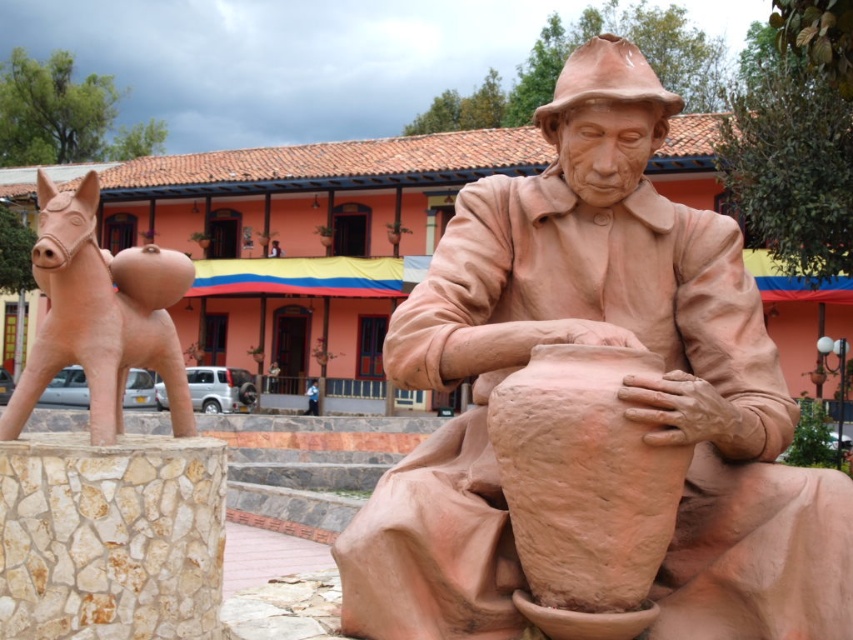
Which of these two, matte clay potter at center or matte clay horse at left, stands shorter?

With less height is matte clay potter at center.

Does matte clay potter at center appear over matte clay horse at left?

No, matte clay potter at center is not above matte clay horse at left.

Is point (590, 332) in front of point (93, 177)?

Yes, point (590, 332) is in front of point (93, 177).

Where is `matte clay potter at center`? The height and width of the screenshot is (640, 853). matte clay potter at center is located at coordinates (619, 390).